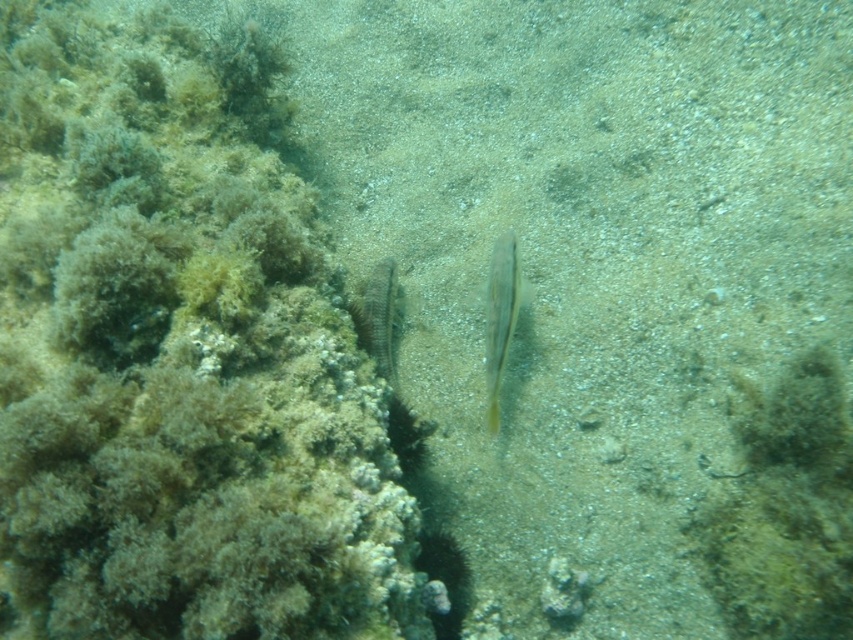
Question: Which object appears farthest from the camera in this image?

Choices:
 (A) greenish-brown textured coral reef at left
 (B) yellow translucent fish at center

Answer: (B)

Question: Does greenish-brown textured coral reef at left lie in front of yellow translucent fish at center?

Choices:
 (A) no
 (B) yes

Answer: (B)

Question: Is greenish-brown textured coral reef at left above yellow translucent fish at center?

Choices:
 (A) yes
 (B) no

Answer: (A)

Question: Can you confirm if greenish-brown textured coral reef at left is positioned to the right of yellow translucent fish at center?

Choices:
 (A) yes
 (B) no

Answer: (B)